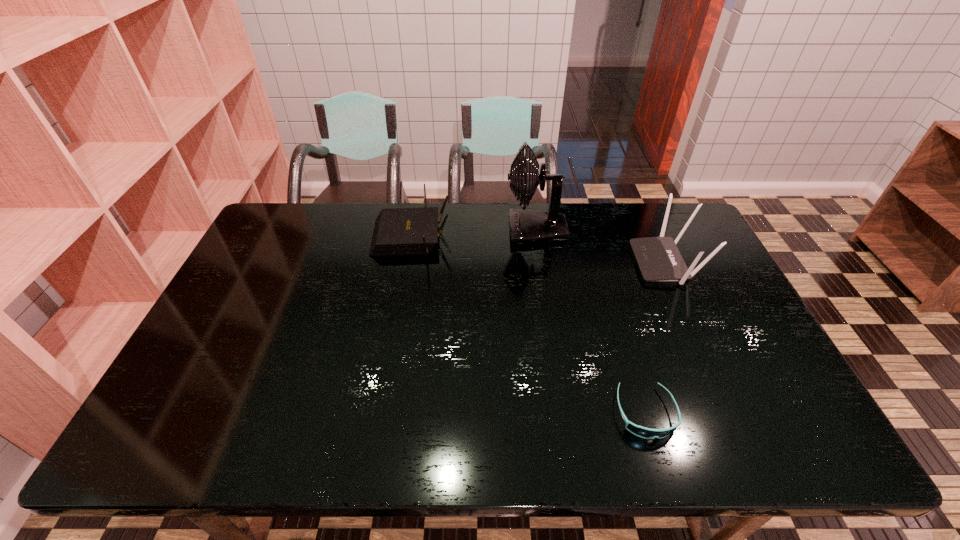
Where is `the tallest object`? the tallest object is located at coordinates (526, 226).

Locate an element on the screen. This screenshot has height=540, width=960. the third object from right to left is located at coordinates (526, 226).

This screenshot has height=540, width=960. In order to click on the rightmost object in this screenshot , I will do `click(658, 258)`.

Where is `the right router`? the right router is located at coordinates (658, 258).

Locate an element on the screen. This screenshot has height=540, width=960. the second shortest object is located at coordinates (398, 231).

What are the coordinates of `the left router` in the screenshot? It's located at (398, 231).

Identify the location of the nearest object. (643, 432).

Find the location of a particular element. sunglasses is located at coordinates (643, 432).

Image resolution: width=960 pixels, height=540 pixels. In order to click on vacant space situated 0.050m in front of the fan to blow air in this screenshot , I will do `click(491, 230)`.

Where is `vacant space located 0.300m in front of the fan to blow air`? vacant space located 0.300m in front of the fan to blow air is located at coordinates (419, 230).